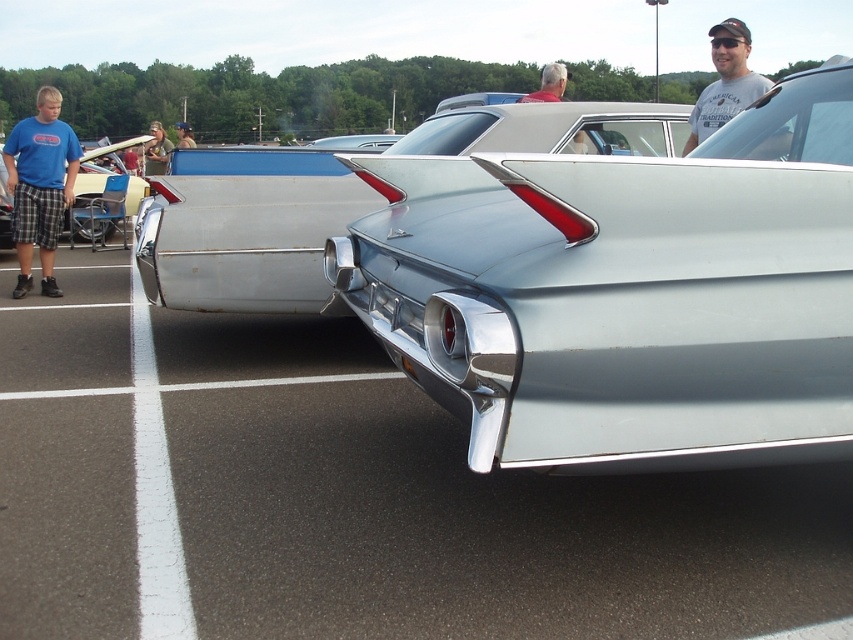
Question: Is silver metallic tail fin at center above blue cotton shirt at left?

Choices:
 (A) no
 (B) yes

Answer: (A)

Question: Which of the following is the farthest from the observer?

Choices:
 (A) gray t-shirt at upper right
 (B) shiny chrome tail light at center
 (C) shiny silver tail fin at left
 (D) camouflage fabric shirt at upper left

Answer: (D)

Question: Is gray t-shirt at upper right further to camera compared to camouflage fabric shirt at upper left?

Choices:
 (A) no
 (B) yes

Answer: (A)

Question: Is shiny chrome tail light at center smaller than shiny silver tail fin at left?

Choices:
 (A) no
 (B) yes

Answer: (A)

Question: Which point is closer to the camera taking this photo?

Choices:
 (A) (271, 172)
 (B) (755, 97)

Answer: (B)

Question: Which of the following is the closest to the observer?

Choices:
 (A) blue cotton shirt at left
 (B) camouflage fabric shirt at upper left
 (C) shiny silver tail fin at left
 (D) gray t-shirt at upper right

Answer: (D)